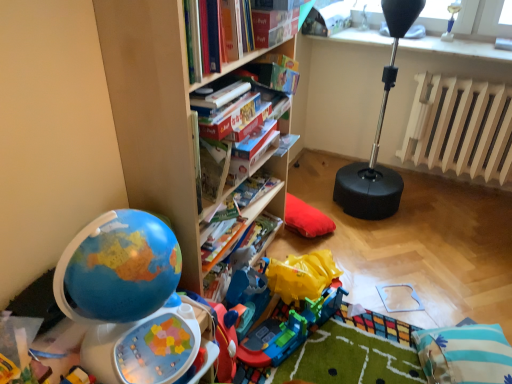
Question: Considering their positions, is hardcover book at center, the second paperback book in the back-to-front sequence, located in front of or behind blue striped pillow at lower right?

Choices:
 (A) front
 (B) behind

Answer: (B)

Question: From the image's perspective, is hardcover book at center, the second paperback book in the back-to-front sequence, above or below blue striped pillow at lower right?

Choices:
 (A) below
 (B) above

Answer: (B)

Question: Which object is the farthest from the shiny plastic globe at left?

Choices:
 (A) blue striped pillow at lower right
 (B) hardcover book at center
 (C) hardcover book at center, marked as the first paperback book in a back-to-front arrangement
 (D) wooden radiator at right
 (E) wooden bookshelf at center

Answer: (D)

Question: Which object is the farthest from the blue striped pillow at lower right?

Choices:
 (A) hardcover book at center, which ranks as the 1th paperback book in front-to-back order
 (B) hardcover book at center
 (C) shiny plastic globe at left
 (D) wooden bookshelf at center
 (E) wooden radiator at right

Answer: (E)